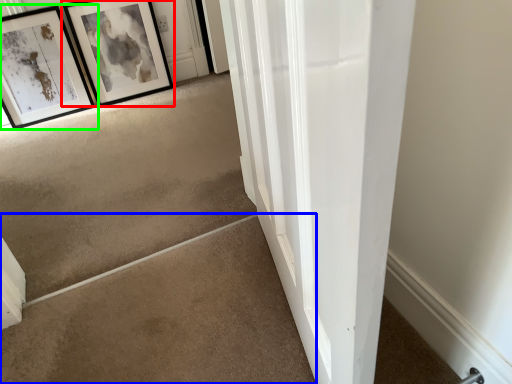
Question: Estimate the real-world distances between objects in this image. Which object is farther from picture frame (highlighted by a red box), concrete (highlighted by a blue box) or picture frame (highlighted by a green box)?

Choices:
 (A) concrete
 (B) picture frame

Answer: (A)